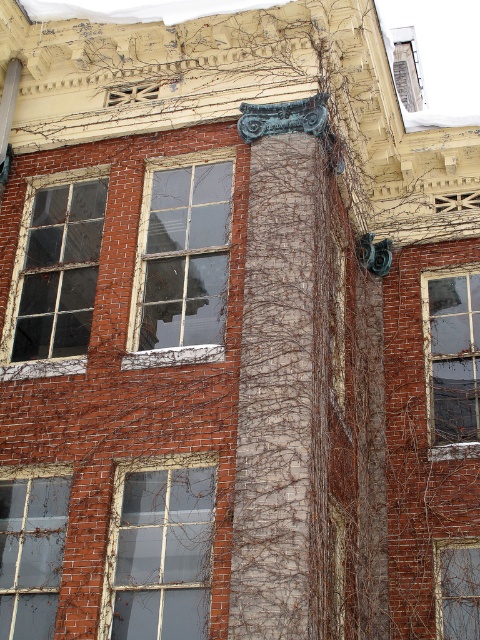
You are standing in front of the multi story brick building. You want to see through the transparent glass window at center. Where should you look?

You should look at point (181, 260) to see through the transparent glass window at center.

You are standing in front of the building and want to take a photo that includes both point (201, 170) and point (465, 410). Which point will appear larger in your photo?

Point (201, 170) is closer to the camera than point (465, 410), so it will appear larger in the photo.

You are a window installer assessing the building. You have two identical window frames to replace broken windows. The first frame is 1.2 meters wide and the second is 0.9 meters wide. Which window frame should you use for the transparent glass window at center and which for the transparent glass window at lower right?

The transparent glass window at center has a larger width than the transparent glass window at lower right. Therefore, the 1.2 meter wide frame should be used for the transparent glass window at center, and the 0.9 meter wide frame should be used for the transparent glass window at lower right.